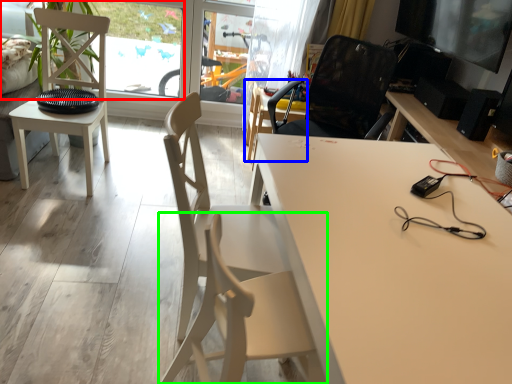
Question: Considering the real-world distances, which object is farthest from window screen (highlighted by a red box)? chair (highlighted by a blue box) or chair (highlighted by a green box)?

Choices:
 (A) chair
 (B) chair

Answer: (B)